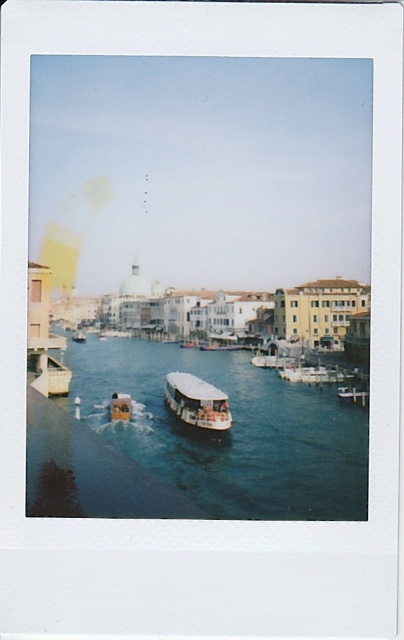
Question: Is blue waterway at center further to camera compared to white matte boat at center?

Choices:
 (A) no
 (B) yes

Answer: (A)

Question: Can you confirm if blue waterway at center is positioned below white matte boat at center?

Choices:
 (A) yes
 (B) no

Answer: (A)

Question: Which point is closer to the camera?

Choices:
 (A) (237, 497)
 (B) (206, 413)

Answer: (A)

Question: Which point appears closest to the camera in this image?

Choices:
 (A) [x=319, y=403]
 (B) [x=183, y=397]

Answer: (B)

Question: Is blue waterway at center below white matte boat at center?

Choices:
 (A) yes
 (B) no

Answer: (A)

Question: Which point is farther to the camera?

Choices:
 (A) white matte boat at center
 (B) blue waterway at center

Answer: (A)